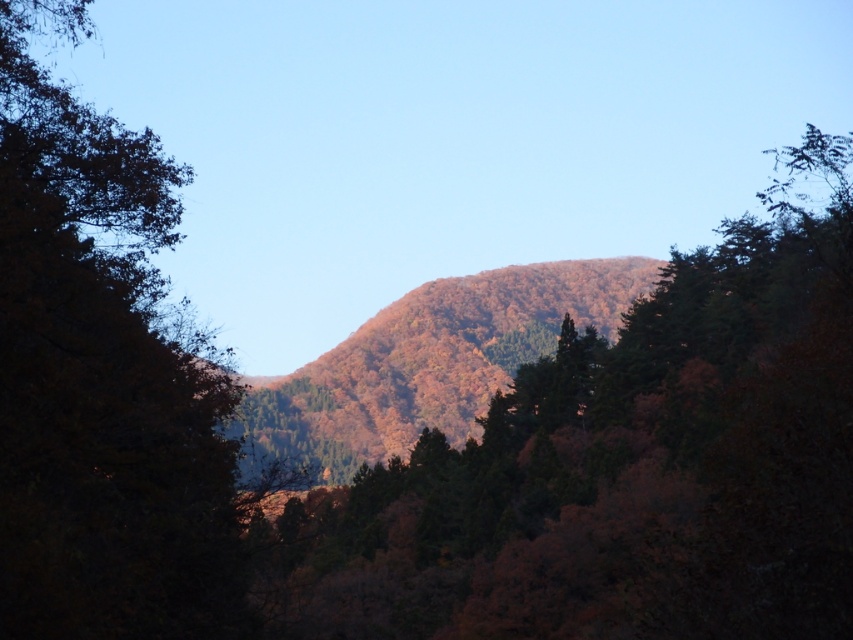
Can you confirm if dark green leafy tree at left is positioned to the right of autumn foliage hill at center?

No, dark green leafy tree at left is not to the right of autumn foliage hill at center.

Is dark green leafy tree at left thinner than autumn foliage hill at center?

Yes, dark green leafy tree at left is thinner than autumn foliage hill at center.

Who is more distant from viewer, (157, 504) or (340, 381)?

Positioned behind is point (340, 381).

I want to click on dark green leafy tree at left, so click(x=102, y=378).

Image resolution: width=853 pixels, height=640 pixels. In order to click on autumn leaves at center in this screenshot , I will do `click(624, 465)`.

Is autumn leaves at center bigger than autumn foliage hill at center?

Correct, autumn leaves at center is larger in size than autumn foliage hill at center.

Which is behind, point (413, 580) or point (390, 360)?

Positioned behind is point (390, 360).

Locate an element on the screen. This screenshot has height=640, width=853. autumn leaves at center is located at coordinates (624, 465).

Which is more to the left, autumn leaves at center or dark green leafy tree at left?

dark green leafy tree at left is more to the left.

The image size is (853, 640). I want to click on autumn leaves at center, so click(x=624, y=465).

Where is `autumn leaves at center`? This screenshot has width=853, height=640. autumn leaves at center is located at coordinates (624, 465).